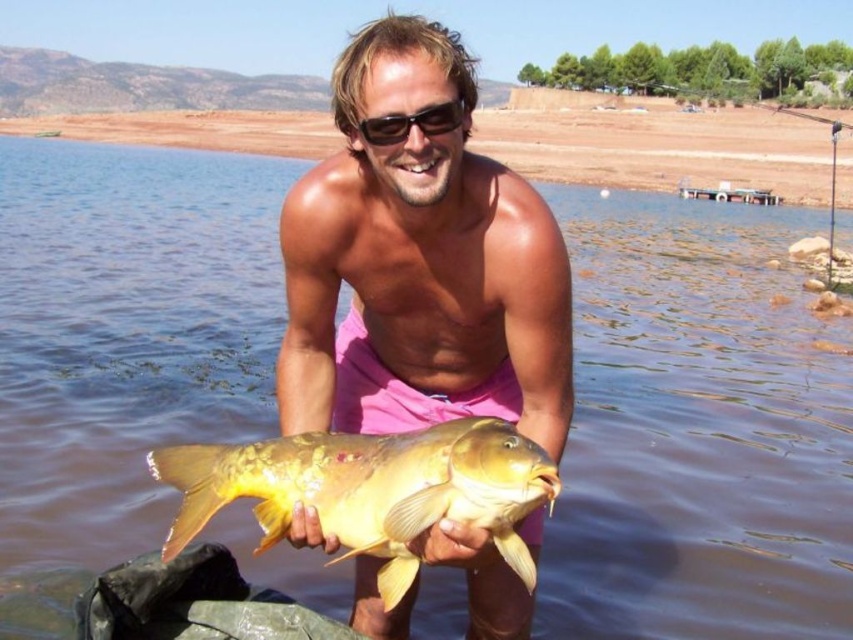
Based on the photo, you are a photographer trying to capture the man in the scene. You need to focus on the pink matte shorts at center and the golden matte fish at center. Which object is wider in the image?

The pink matte shorts at center is wider than the golden matte fish at center.

You are a photographer trying to capture the man in the scene. You notice the pink matte shorts at center and the golden matte fish at center. Which object is taller in the image?

The pink matte shorts at center is taller than the golden matte fish at center.